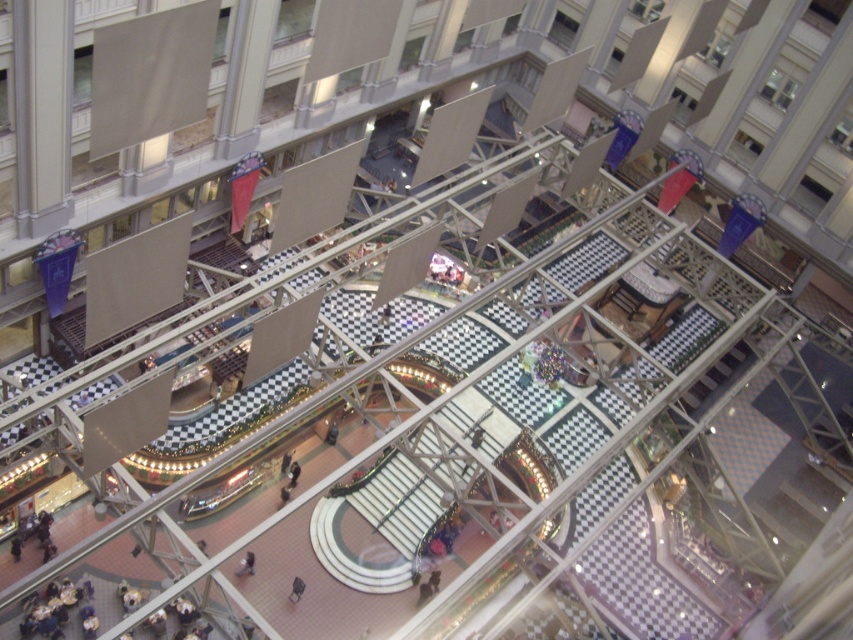
You are standing in the atrium and see a point marked at coordinates (247, 564). Based on the scene description, what object or feature is located at that point?

The point at coordinates (247, 564) is on the smooth beige coat at center.

You are a delivery person carrying a large box that requires a 3 meter wide path to move through. You see the smooth beige coat at center and the dark gray fabric jacket at center in the atrium. Is there enough space between them to move your box through?

The smooth beige coat at center and dark gray fabric jacket at center are 5.03 meters apart from each other, so yes, there is enough space between them to move the box through since 5.03 meters is wider than the required 3 meters.